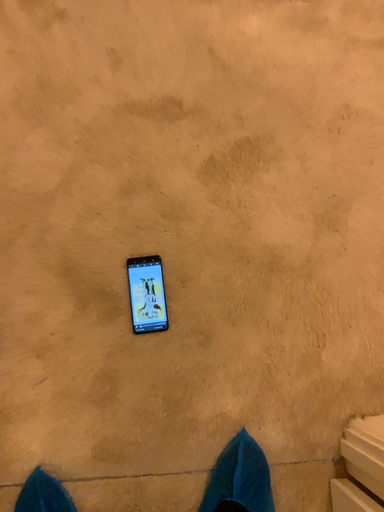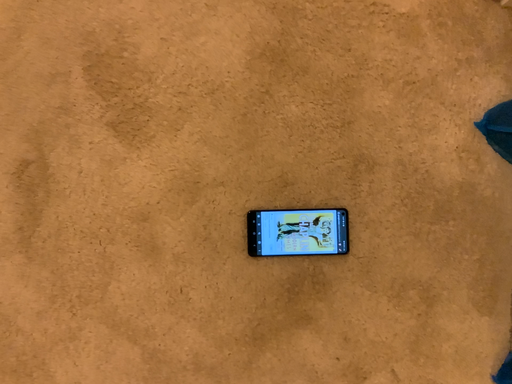
Question: Which way did the camera rotate in the video?

Choices:
 (A) rotated right
 (B) rotated left

Answer: (A)